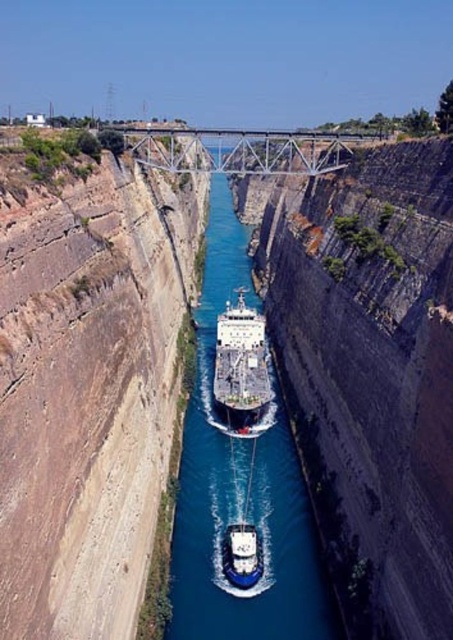
Identify the location of white glossy ship at center. (240, 362).

Describe the element at coordinates (240, 362) in the screenshot. This screenshot has width=453, height=640. I see `white glossy ship at center` at that location.

Identify the location of white glossy ship at center. The width and height of the screenshot is (453, 640). (240, 362).

Is blue smooth water at center smaller than white glossy ship at center?

No, blue smooth water at center is not smaller than white glossy ship at center.

Between blue smooth water at center and white glossy ship at center, which one appears on the left side from the viewer's perspective?

From the viewer's perspective, blue smooth water at center appears more on the left side.

Find the location of a particular element. Image resolution: width=453 pixels, height=640 pixels. blue smooth water at center is located at coordinates (240, 484).

Between blue smooth water at center and white glossy boat at center, which one is positioned lower?

white glossy boat at center is lower down.

Can you confirm if blue smooth water at center is bigger than white glossy boat at center?

Indeed, blue smooth water at center has a larger size compared to white glossy boat at center.

Where is `blue smooth water at center`? This screenshot has height=640, width=453. blue smooth water at center is located at coordinates (240, 484).